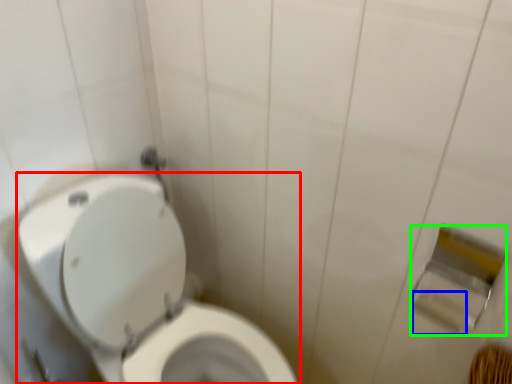
Question: Estimate the real-world distances between objects in this image. Which object is closer to toilet (highlighted by a red box), toilet paper (highlighted by a blue box) or toilet paper (highlighted by a green box)?

Choices:
 (A) toilet paper
 (B) toilet paper

Answer: (B)